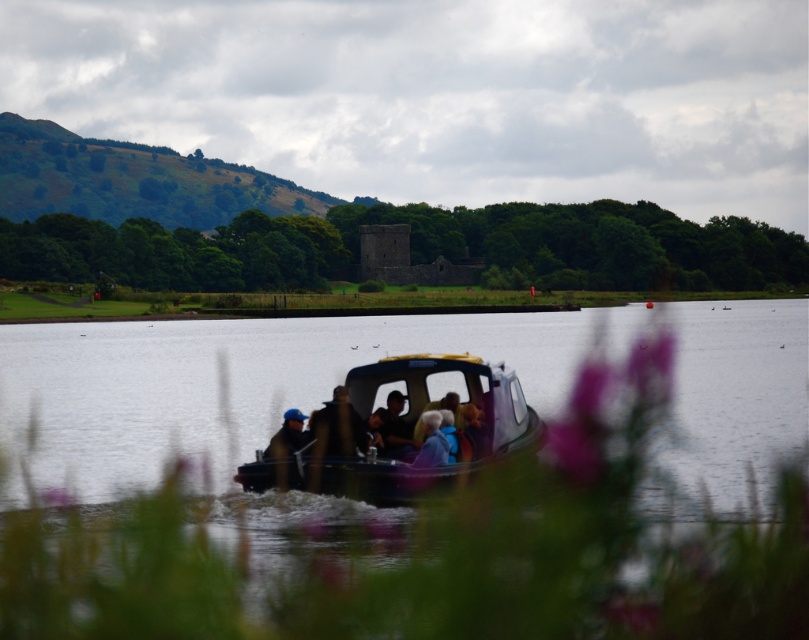
You are a photographer trying to capture the clear water at center and the dark brown leather jacket at center in the same frame. Based on their positions, do you think you can fit both objects into your camera viewfinder without moving the camera?

The clear water at center might be wider than dark brown leather jacket at center, so there is a possibility that both can be captured in the same frame if the jacket is positioned within the water area or adjacent to it. However, the exact arrangement depends on their spatial relationship beyond width.

Looking at this image, based on the coordinates provided, which object in the image is located at point [477,531]?

The clear water at center is located at point [477,531].

You are a photographer standing on the deck of the boat and want to take a photo of the clear water at center and the dark brown leather jacket at center. Which object will appear taller in the photo?

The clear water at center will appear taller in the photo because it has a greater height compared to the dark brown leather jacket at center according to the description.